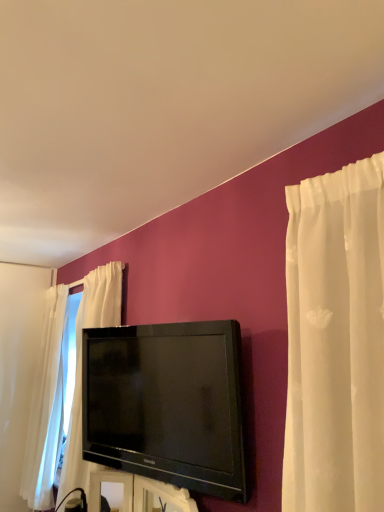
Question: From a real-world perspective, does black glossy tv at center stand above black glossy tv at center?

Choices:
 (A) yes
 (B) no

Answer: (A)

Question: Does black glossy tv at center have a lesser width compared to black glossy tv at center?

Choices:
 (A) no
 (B) yes

Answer: (B)

Question: From the image's perspective, is black glossy tv at center located beneath black glossy tv at center?

Choices:
 (A) yes
 (B) no

Answer: (B)

Question: Can you confirm if black glossy tv at center is positioned to the left of black glossy tv at center?

Choices:
 (A) yes
 (B) no

Answer: (A)

Question: Considering the relative sizes of black glossy tv at center and black glossy tv at center in the image provided, is black glossy tv at center bigger than black glossy tv at center?

Choices:
 (A) no
 (B) yes

Answer: (B)

Question: Is black glossy tv at center turned away from black glossy tv at center?

Choices:
 (A) yes
 (B) no

Answer: (B)

Question: From the image's perspective, would you say black glossy tv at center is shown under black glossy tv at center?

Choices:
 (A) yes
 (B) no

Answer: (A)

Question: Is the depth of black glossy tv at center less than that of black glossy tv at center?

Choices:
 (A) no
 (B) yes

Answer: (B)

Question: Does black glossy tv at center have a greater height compared to black glossy tv at center?

Choices:
 (A) yes
 (B) no

Answer: (B)

Question: Is black glossy tv at center bigger than black glossy tv at center?

Choices:
 (A) yes
 (B) no

Answer: (B)

Question: Is black glossy tv at center beside black glossy tv at center?

Choices:
 (A) yes
 (B) no

Answer: (B)

Question: Considering the relative positions of black glossy tv at center and black glossy tv at center in the image provided, is black glossy tv at center behind black glossy tv at center?

Choices:
 (A) no
 (B) yes

Answer: (A)

Question: From the image's perspective, is black glossy tv at center positioned above or below black glossy tv at center?

Choices:
 (A) below
 (B) above

Answer: (A)